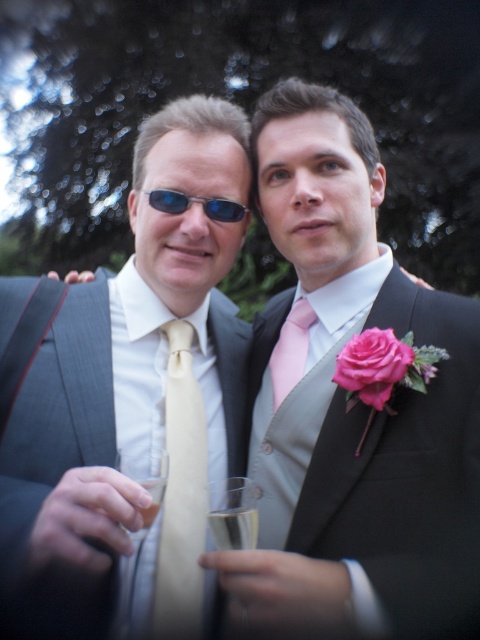
You are a photographer at a formal event. You need to adjust the lighting to ensure both the matte gold tie at center and the blue reflective sunglasses at upper center are visible. Which object should you focus on first to avoid reflections?

The blue reflective sunglasses at upper center should be focused on first because they are above the matte gold tie at center and may cause more glare due to their reflective surface.

You are a photographer at a wedding reception. You need to take a photo of the black satin suit at center. The camera you are using has a minimum focusing distance of 30 inches. Can you take the photo without moving the camera or the subject?

The black satin suit at center and camera are 32.27 inches apart from each other. Since the minimum focusing distance is 30 inches, the camera can focus on the black satin suit at center as the distance is within the required range.